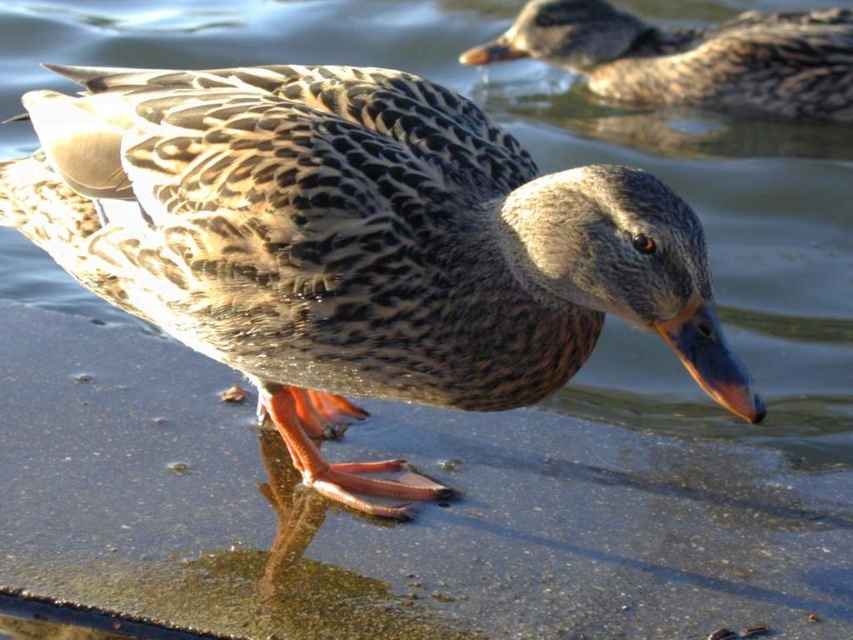
Question: Does speckled feathered duck at center appear under speckled feathered duck at upper center?

Choices:
 (A) no
 (B) yes

Answer: (B)

Question: Which object is closer to the camera taking this photo?

Choices:
 (A) speckled feathered duck at center
 (B) speckled feathered duck at upper center

Answer: (A)

Question: Is speckled feathered duck at center bigger than speckled feathered duck at upper center?

Choices:
 (A) yes
 (B) no

Answer: (A)

Question: Which object is closer to the camera taking this photo?

Choices:
 (A) speckled feathered duck at upper center
 (B) speckled feathered duck at center

Answer: (B)

Question: Does speckled feathered duck at center appear on the right side of speckled feathered duck at upper center?

Choices:
 (A) no
 (B) yes

Answer: (A)